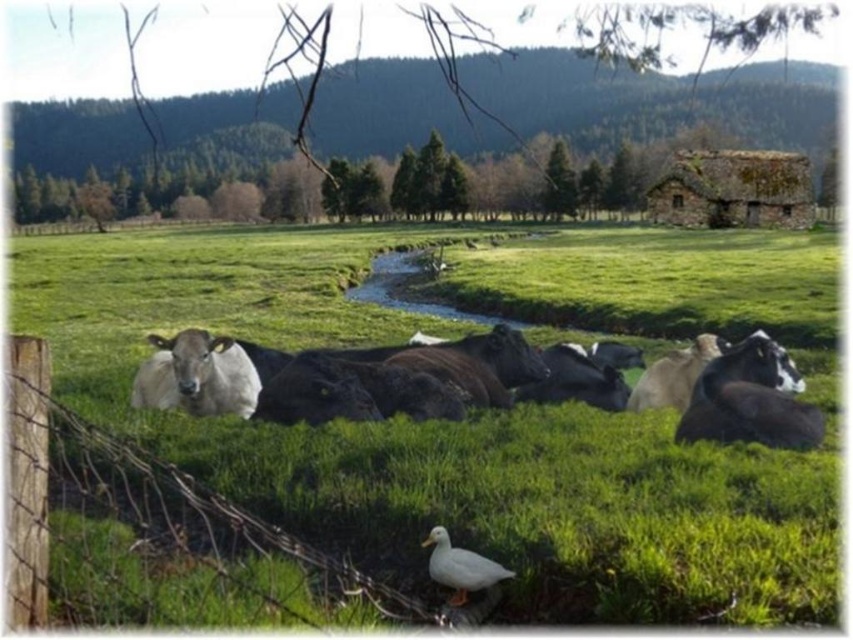
Question: Can you confirm if green grassy at center is positioned to the right of white glossy cow at center?

Choices:
 (A) no
 (B) yes

Answer: (A)

Question: Among these points, which one is nearest to the camera?

Choices:
 (A) 448,557
 (B) 158,396

Answer: (A)

Question: Can you confirm if green grassy at center is smaller than white woolly sheep at lower left?

Choices:
 (A) no
 (B) yes

Answer: (A)

Question: Based on their relative distances, which object is farther from the wooden post at lower left?

Choices:
 (A) white woolly sheep at lower left
 (B) green grassy at center

Answer: (B)

Question: Is green grassy at center positioned at the back of wooden post at lower left?

Choices:
 (A) yes
 (B) no

Answer: (A)

Question: Which object is positioned farthest from the green grassy at center?

Choices:
 (A) wooden post at lower left
 (B) white woolly sheep at lower left
 (C) white matte duck at lower center

Answer: (B)